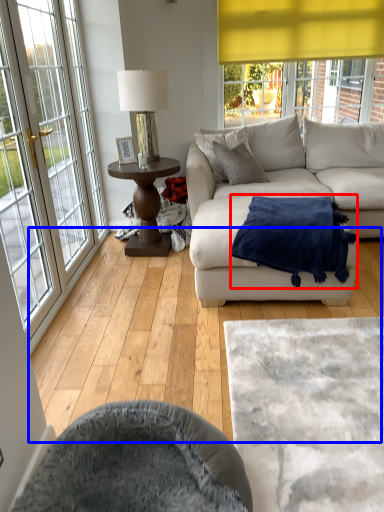
Question: Among these objects, which one is farthest to the camera, blanket (highlighted by a red box) or hardwood (highlighted by a blue box)?

Choices:
 (A) blanket
 (B) hardwood

Answer: (A)